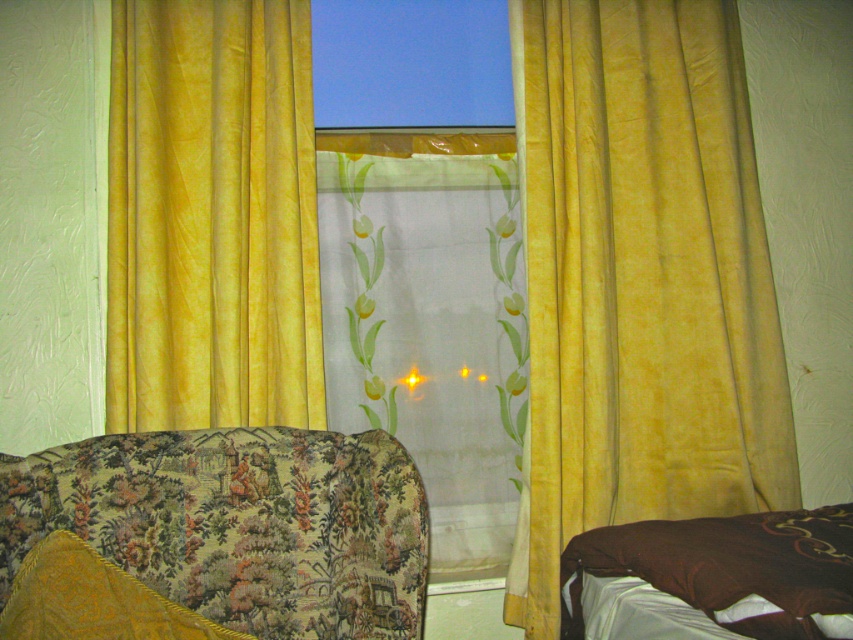
Can you confirm if yellow velvet curtain at center is thinner than yellow velvet curtains at left?

No.

Does yellow velvet curtain at center have a larger size compared to yellow velvet curtains at left?

Correct, yellow velvet curtain at center is larger in size than yellow velvet curtains at left.

Does point (567, 472) lie behind point (242, 349)?

That is True.

At what (x,y) coordinates should I click in order to perform the action: click on yellow velvet curtain at center. Please return your answer as a coordinate pair (x, y). Looking at the image, I should click on click(643, 280).

Who is more distant from viewer, (730, 289) or (386, 136)?

The point (386, 136) is behind.

Which is in front, point (643, 348) or point (468, 397)?

Positioned in front is point (643, 348).

Is point (664, 301) positioned behind point (419, 410)?

No, (664, 301) is closer to viewer.

This screenshot has width=853, height=640. In order to click on yellow velvet curtain at center in this screenshot , I will do pyautogui.click(x=643, y=280).

What do you see at coordinates (212, 218) in the screenshot? This screenshot has height=640, width=853. I see `yellow velvet curtains at left` at bounding box center [212, 218].

Is yellow velvet curtains at left wider than brown soft pillow at lower right?

Incorrect, yellow velvet curtains at left's width does not surpass brown soft pillow at lower right's.

Which is behind, point (132, 368) or point (701, 564)?

The point (132, 368) is more distant.

Where is `yellow velvet curtains at left`? yellow velvet curtains at left is located at coordinates (212, 218).